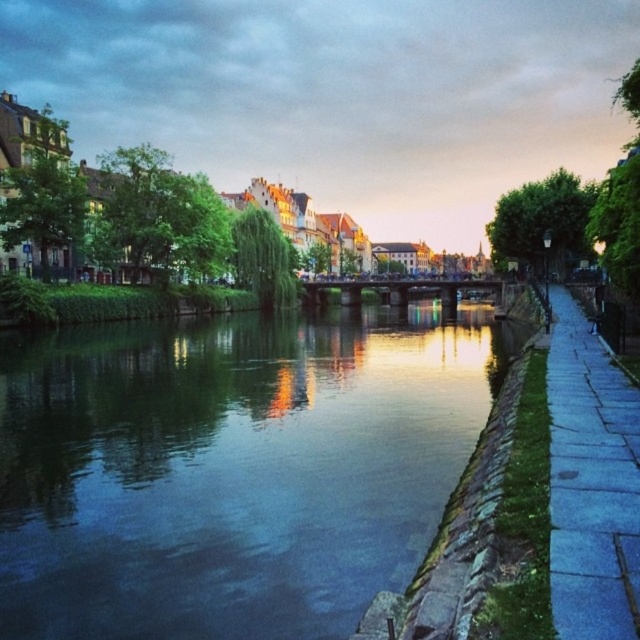
Looking at this image, you are a delivery person needing to cross the river to deliver a package. The green stone river at center is in your way. Can you step over it using the blue stone sidewalk at right? Explain why or why not based on their heights.

The green stone river at center is taller than the blue stone sidewalk at right. Since the river is higher than the sidewalk, you cannot step over the river using the sidewalk because the river is elevated compared to the sidewalk.

You are a tourist holding a map and want to cross the river to reach the buildings on the left side. The map shows a path that goes along the blue stone sidewalk at right. However, you notice the green stone river at center. Which path should you take to safely reach the buildings on the left side?

The green stone river at center is bigger than the blue stone sidewalk at right, so the blue stone sidewalk at right is the narrower path. To safely reach the buildings on the left side, you should follow the blue stone sidewalk at right towards the bridge, as the river itself may be too wide to cross without a bridge or boat.

You are standing on the blue stone sidewalk at right and want to cross to the green stone river at center. Is the river closer to you than the sidewalk you are currently on?

The green stone river at center is further to the viewer than the blue stone sidewalk at right, so the river is actually farther away from you than the sidewalk you are standing on.